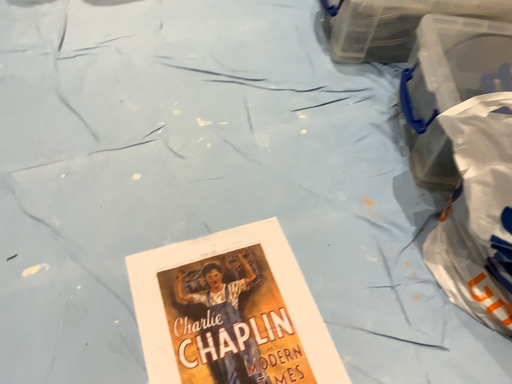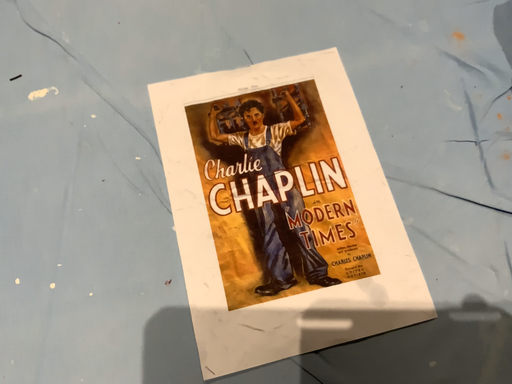
Question: How did the camera likely rotate when shooting the video?

Choices:
 (A) rotated downward
 (B) rotated upward

Answer: (A)